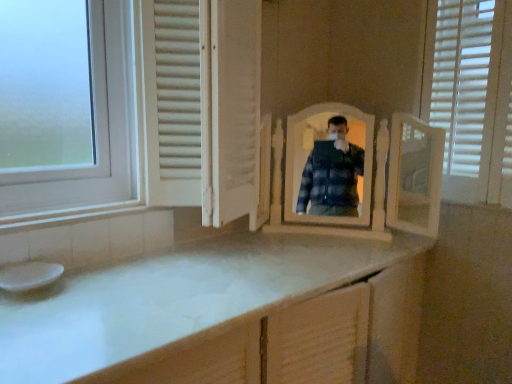
Question: In terms of width, does white matte screen door at center look wider or thinner when compared to white glossy sink at lower left?

Choices:
 (A) wide
 (B) thin

Answer: (A)

Question: Is white matte screen door at center to the left or to the right of white glossy sink at lower left in the image?

Choices:
 (A) left
 (B) right

Answer: (B)

Question: Which object is the closest to the white wooden mirror at center?

Choices:
 (A) white glossy sink at lower left
 (B) white matte screen door at center

Answer: (B)

Question: Estimate the real-world distances between objects in this image. Which object is farther from the white matte screen door at center?

Choices:
 (A) white glossy sink at lower left
 (B) white wooden mirror at center

Answer: (A)